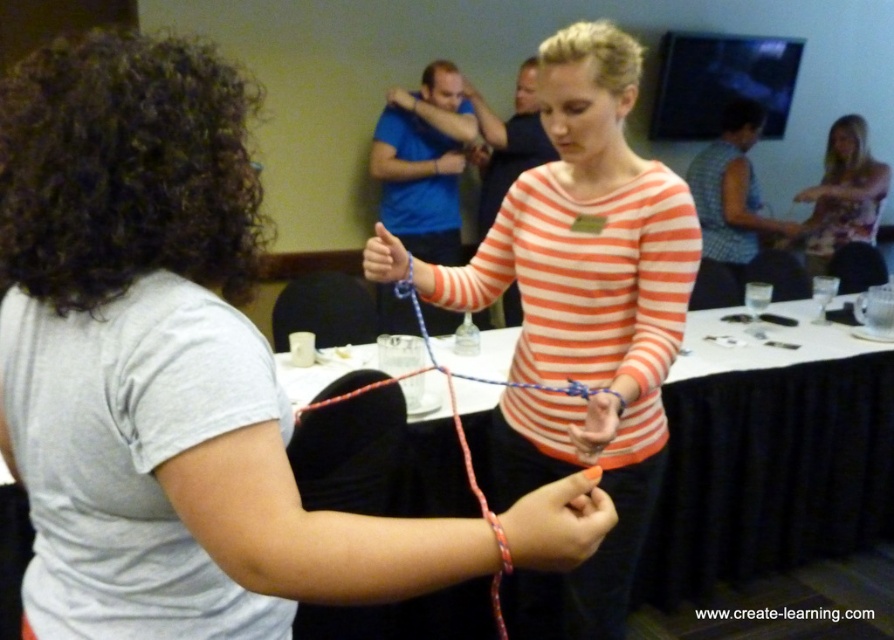
You are organizing a workshop and need to place a decorative banner on the table. However, there is an attendee wearing a matte orange striped shirt at center. Can you place the banner on the matte plastic table at center without moving the attendee?

The matte orange striped shirt at center is positioned over matte plastic table at center, meaning the attendee is standing or sitting on the table. Therefore, you cannot place the banner on the matte plastic table at center without first asking the attendee to move.